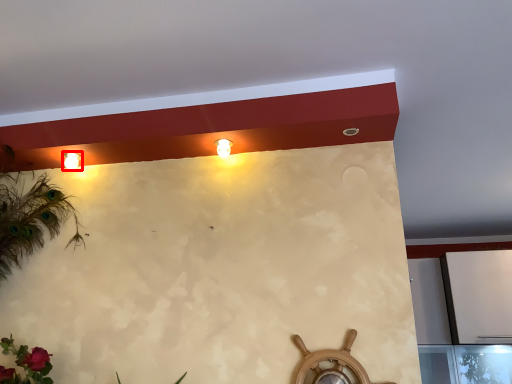
Question: From the image's perspective, what is the correct spatial relationship of lamp (annotated by the red box) in relation to fixture?

Choices:
 (A) above
 (B) below

Answer: (B)